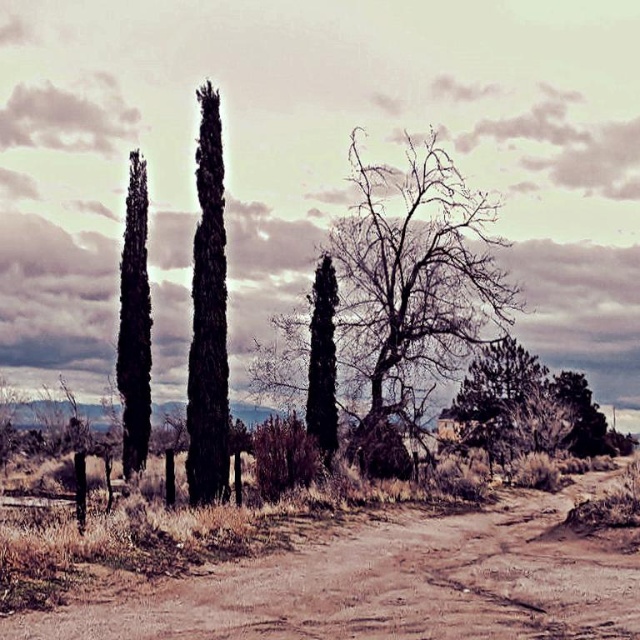
Question: Which of the following is the farthest from the observer?

Choices:
 (A) green textured bush at right
 (B) dark green textured cypress tree at center

Answer: (A)

Question: Does green textured bush at right appear on the right side of dark green textured cypress tree at left?

Choices:
 (A) no
 (B) yes

Answer: (B)

Question: In this image, where is bare branches at center located relative to green textured bush at right?

Choices:
 (A) below
 (B) above

Answer: (B)

Question: Which object is closer to the camera taking this photo?

Choices:
 (A) dark green textured cypress tree at left
 (B) brown sandy dirt at center
 (C) green textured bush at right
 (D) bare branches at center

Answer: (B)

Question: Which of the following is the farthest from the observer?

Choices:
 (A) green textured bush at right
 (B) brown sandy dirt at center

Answer: (A)

Question: Can you confirm if dark green textured cypress tree at center is smaller than dark green textured cypress tree at left?

Choices:
 (A) yes
 (B) no

Answer: (B)